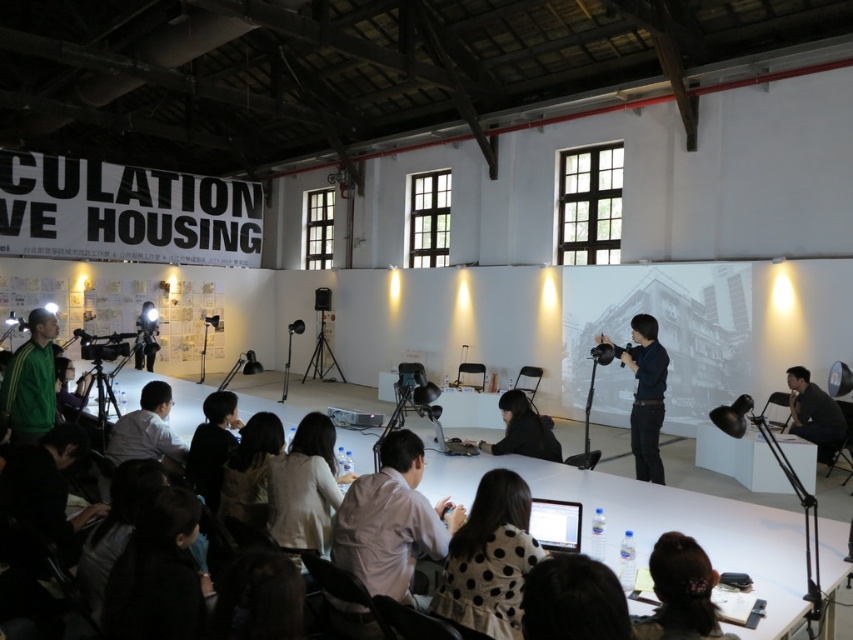
Question: Which object is positioned farthest from the white matte shirt at lower center?

Choices:
 (A) green adidas jacket at lower left
 (B) brown hair at lower center
 (C) white dotted dress at center
 (D) black matte jacket at lower center

Answer: (B)

Question: Does light beige shirt at center have a larger size compared to white matte shirt at lower center?

Choices:
 (A) yes
 (B) no

Answer: (A)

Question: Which object is positioned closest to the matte black camera at lower left?

Choices:
 (A) white matte shirt at center
 (B) black matte jacket at lower center
 (C) black fabric at center
 (D) white matte shirt at lower center

Answer: (D)

Question: Which point is closer to the camera?

Choices:
 (A) (548, 445)
 (B) (219, 394)
 (C) (804, 420)
 (D) (593, 564)

Answer: (D)

Question: Does black leather jacket at lower right appear over matte black camera at lower left?

Choices:
 (A) no
 (B) yes

Answer: (A)

Question: In this image, where is black matte camera at center located relative to matte black projector at center?

Choices:
 (A) left
 (B) right

Answer: (B)